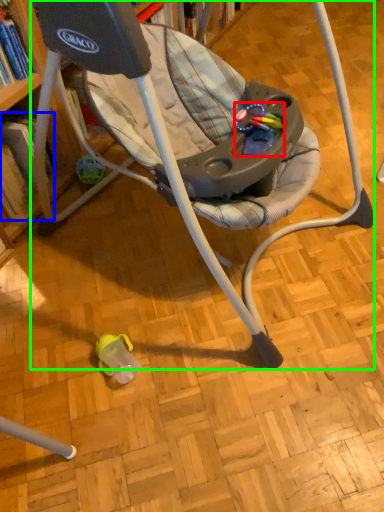
Question: Considering the real-world distances, which object is closest to toy (highlighted by a red box)? book (highlighted by a blue box) or chair (highlighted by a green box).

Choices:
 (A) book
 (B) chair

Answer: (B)